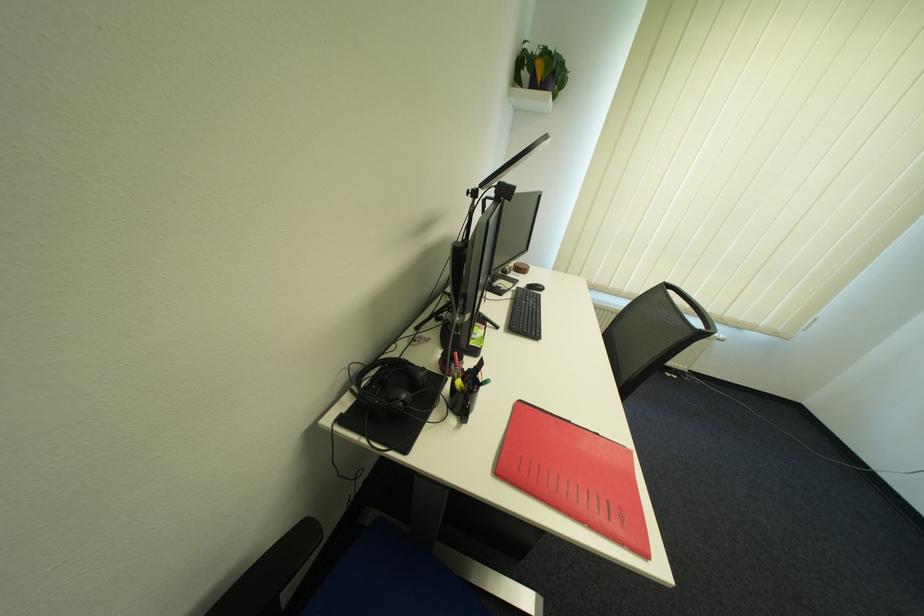
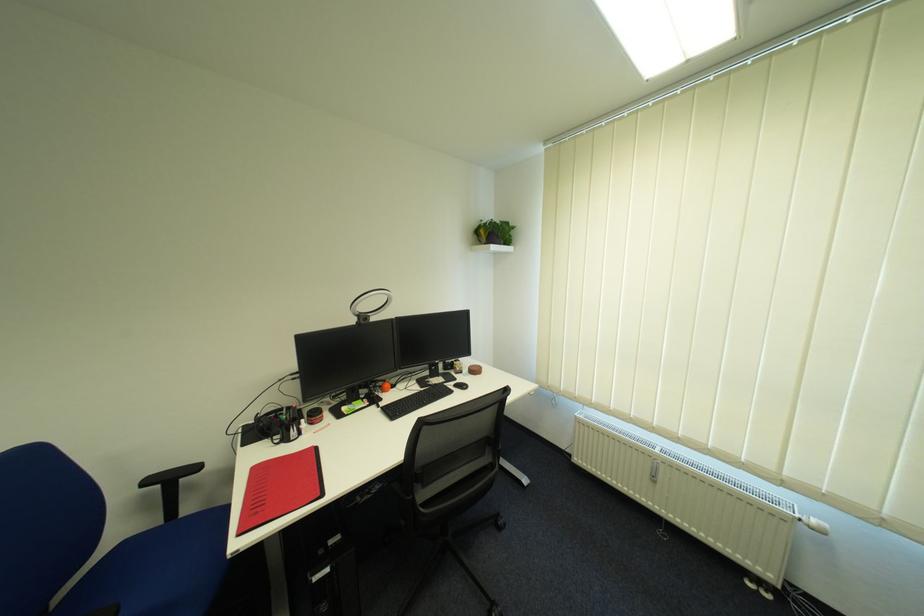
Find the pixel in the second image that matches (565,71) in the first image.

(503, 233)